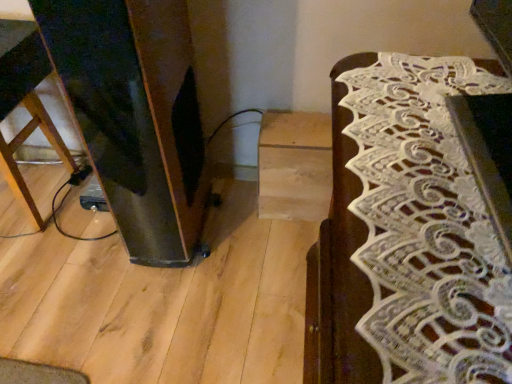
Image resolution: width=512 pixels, height=384 pixels. Identify the location of vacant region below wooden stool at left, placed as the first furniture when sorted from left to right (from a real-world perspective). (37, 191).